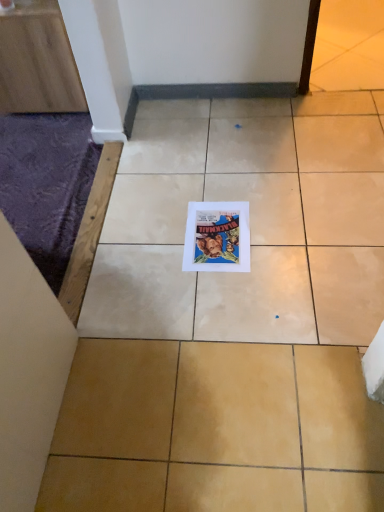
Locate an element on the screen. The width and height of the screenshot is (384, 512). vacant area situated to the left side of matte paper comic book at center is located at coordinates (152, 245).